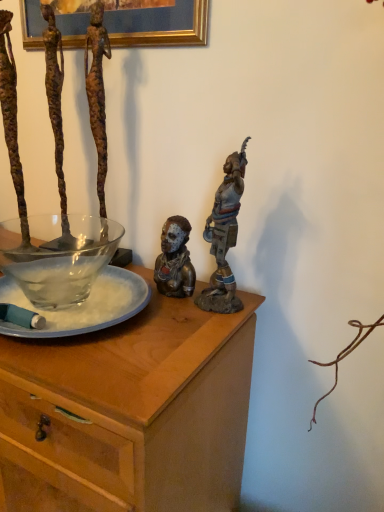
The image size is (384, 512). What are the coordinates of `free spot in front of bronze statue at upper right, the first person in the right-to-left sequence` in the screenshot? It's located at (185, 339).